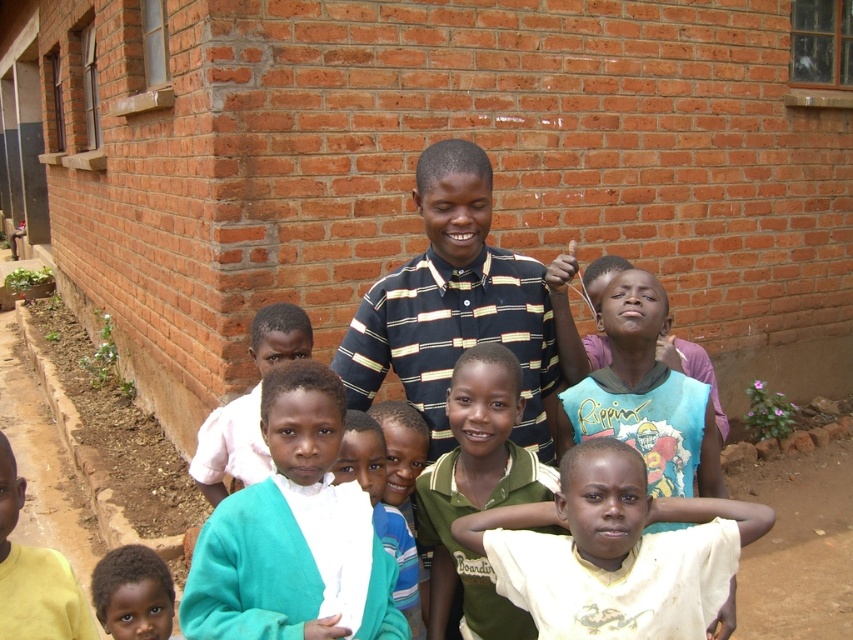
You are a photographer trying to capture a clear photo of the green jersey at center. However, there is another person wearing a white matte shirt at lower center blocking the view. Can you adjust your position to take the photo without moving the subjects?

The white matte shirt at lower center is in front of the green jersey at center, so moving your camera position to the side or angle might allow you to capture the green jersey at center without the obstruction.

You are a photographer trying to capture a group photo of the white matte shirt at lower center and dark brown skin at lower left. The camera you are using has a minimum focusing distance of 1.5 meters. Can you take a clear photo of both subjects without moving them?

The white matte shirt at lower center is 1.29 meters from dark brown skin at lower left. Since the distance between them is less than the camera minimum focusing distance of 1.5 meters, the camera may not be able to focus properly on both subjects simultaneously. You might need to move closer or adjust the camera settings for better focus.